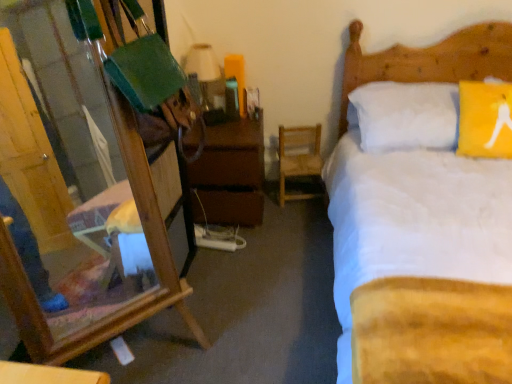
I want to click on wooden mirror at left, so click(11, 73).

You are a GUI agent. You are given a task and a screenshot of the screen. Output one action in this format:
    pyautogui.click(x=<x>, y=<y>)
    Task: Click on the brown wooden nightstand at center
    The image size is (512, 384).
    Given the screenshot: What is the action you would take?
    pyautogui.click(x=231, y=173)

This screenshot has height=384, width=512. Describe the element at coordinates (205, 75) in the screenshot. I see `matte white lampshade at upper center` at that location.

Find the location of a particular element. Image resolution: width=512 pixels, height=384 pixels. wooden chair at center is located at coordinates (298, 157).

Consider the image. Which is further, (284, 141) or (238, 179)?

Positioned behind is point (284, 141).

Considering the sizes of objects wooden chair at center and brown wooden nightstand at center in the image provided, who is wider, wooden chair at center or brown wooden nightstand at center?

brown wooden nightstand at center.

Is the depth of wooden chair at center greater than that of brown wooden nightstand at center?

Yes, wooden chair at center is further from the camera.

Between wooden chair at center and brown wooden nightstand at center, which one appears on the left side from the viewer's perspective?

Positioned to the left is brown wooden nightstand at center.

Considering the positions of objects wooden mirror at left and white soft bed at upper right in the image provided, who is more to the left, wooden mirror at left or white soft bed at upper right?

From the viewer's perspective, wooden mirror at left appears more on the left side.

In the scene shown: Between wooden mirror at left and white soft bed at upper right, which one has larger size?

Bigger between the two is white soft bed at upper right.

Is wooden mirror at left inside the boundaries of white soft bed at upper right, or outside?

wooden mirror at left is located beyond the bounds of white soft bed at upper right.

Between point (111, 322) and point (365, 68), which one is positioned in front?

The point (111, 322) is more forward.

Is brown wooden nightstand at center with white soft bed at upper right?

No, brown wooden nightstand at center is not beside white soft bed at upper right.

From a real-world perspective, who is located higher, brown wooden nightstand at center or white soft bed at upper right?

In real-world perspective, white soft bed at upper right is above.

Would you say brown wooden nightstand at center is to the left or to the right of white soft bed at upper right in the picture?

From the image, it's evident that brown wooden nightstand at center is to the left of white soft bed at upper right.

What are the coordinates of `nightstand on the left of white soft bed at upper right` in the screenshot? It's located at (231, 173).

From the image's perspective, is matte white lampshade at upper center above or below brown wooden nightstand at center?

Clearly, from the image's perspective, matte white lampshade at upper center is above brown wooden nightstand at center.

In terms of height, does matte white lampshade at upper center look taller or shorter compared to brown wooden nightstand at center?

Clearly, matte white lampshade at upper center is shorter compared to brown wooden nightstand at center.

Which object is closer to the camera, matte white lampshade at upper center or brown wooden nightstand at center?

brown wooden nightstand at center is more forward.

Is point (195, 54) positioned after point (260, 206)?

No.

Considering the sizes of objects white soft bed at upper right and matte white lampshade at upper center in the image provided, who is shorter, white soft bed at upper right or matte white lampshade at upper center?

With less height is matte white lampshade at upper center.

Would you consider white soft bed at upper right to be distant from matte white lampshade at upper center?

Yes.

Is white soft bed at upper right thinner than matte white lampshade at upper center?

In fact, white soft bed at upper right might be wider than matte white lampshade at upper center.

Which object is positioned more to the left, white soft bed at upper right or matte white lampshade at upper center?

matte white lampshade at upper center.

Do you think wooden mirror at left is within matte white lampshade at upper center, or outside of it?

wooden mirror at left is outside matte white lampshade at upper center.

Looking at this image, from the image's perspective, would you say wooden mirror at left is positioned over matte white lampshade at upper center?

No, from the image's perspective, wooden mirror at left is not on top of matte white lampshade at upper center.

Which is farther, (x=170, y=118) or (x=203, y=67)?

Positioned behind is point (x=203, y=67).

Which object is closer to the camera, wooden mirror at left or matte white lampshade at upper center?

wooden mirror at left is closer to the camera.

Is point (290, 153) positioned behind point (391, 68)?

Yes, it is behind point (391, 68).

From the picture: Is wooden chair at center with white soft bed at upper right?

wooden chair at center and white soft bed at upper right are not in contact.

Is wooden chair at center shorter than white soft bed at upper right?

Indeed, wooden chair at center has a lesser height compared to white soft bed at upper right.

Does wooden chair at center appear on the right side of white soft bed at upper right?

Incorrect, wooden chair at center is not on the right side of white soft bed at upper right.

You are a GUI agent. You are given a task and a screenshot of the screen. Output one action in this format:
    pyautogui.click(x=<x>, y=<y>)
    Task: Click on the chair behind the brown wooden nightstand at center
    The width and height of the screenshot is (512, 384).
    Given the screenshot: What is the action you would take?
    pyautogui.click(x=298, y=157)

Locate an element on the screen. The image size is (512, 384). bed to the right of wooden mirror at left is located at coordinates (429, 60).

Looking at the image, which one is located closer to wooden chair at center, wooden mirror at left or matte white lampshade at upper center?

matte white lampshade at upper center is closer to wooden chair at center.

Consider the image. Looking at the image, which one is located closer to white soft bed at upper right, matte white lampshade at upper center or brown wooden nightstand at center?

The object closer to white soft bed at upper right is brown wooden nightstand at center.

Estimate the real-world distances between objects in this image. Which object is further from matte white lampshade at upper center, wooden mirror at left or brown wooden nightstand at center?

Based on the image, wooden mirror at left appears to be further to matte white lampshade at upper center.

Looking at the image, which one is located further to matte white lampshade at upper center, wooden chair at center or wooden mirror at left?

wooden mirror at left is further to matte white lampshade at upper center.

Estimate the real-world distances between objects in this image. Which object is closer to wooden mirror at left, brown wooden nightstand at center or white soft bed at upper right?

Among the two, brown wooden nightstand at center is located nearer to wooden mirror at left.

Considering their positions, is wooden mirror at left positioned further to brown wooden nightstand at center than white soft bed at upper right?

white soft bed at upper right is positioned further to the anchor brown wooden nightstand at center.

Considering their positions, is brown wooden nightstand at center positioned closer to white soft bed at upper right than matte white lampshade at upper center?

brown wooden nightstand at center lies closer to white soft bed at upper right than the other object.

Which object lies nearer to the anchor point matte white lampshade at upper center, wooden mirror at left or wooden chair at center?

Among the two, wooden chair at center is located nearer to matte white lampshade at upper center.

The width and height of the screenshot is (512, 384). Identify the location of mirror between white soft bed at upper right and wooden chair at center in the front-back direction. (11, 73).

I want to click on nightstand between white soft bed at upper right and matte white lampshade at upper center in the front-back direction, so click(231, 173).

Find the location of a particular element. The width and height of the screenshot is (512, 384). mirror between white soft bed at upper right and brown wooden nightstand at center from front to back is located at coordinates tap(11, 73).

Image resolution: width=512 pixels, height=384 pixels. Find the location of `nightstand located between white soft bed at upper right and wooden chair at center in the depth direction`. nightstand located between white soft bed at upper right and wooden chair at center in the depth direction is located at coordinates (231, 173).